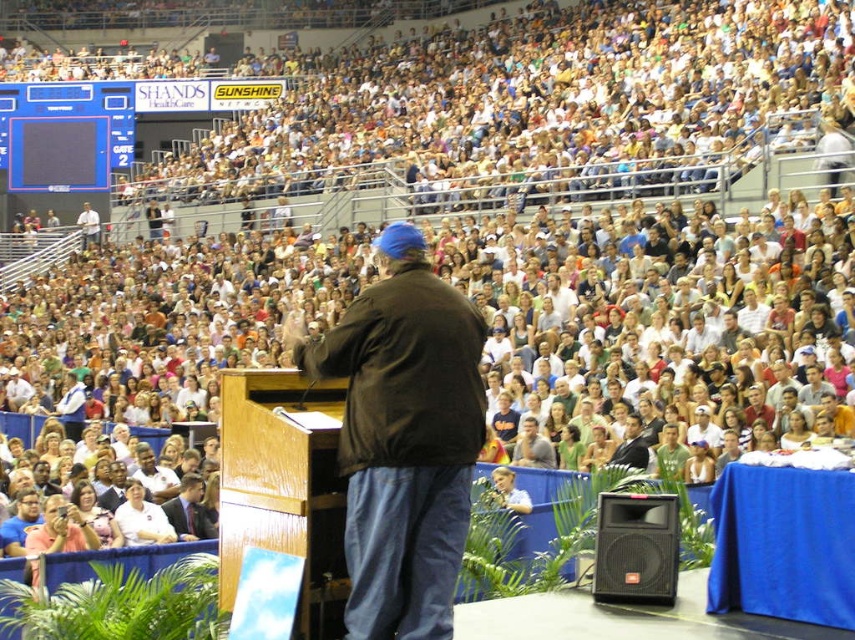
You are an event organizer trying to ensure all attendees have enough space. You notice the dark brown leather jacket at center and the white shirt at lower left. Which clothing item takes up more horizontal space?

The dark brown leather jacket at center takes up more horizontal space because its width is larger than the white shirt at lower left.

You are standing at the wooden podium where the man is speaking. You want to walk directly to the point marked at coordinates point (408, 280). Will you pass by the point marked at coordinates point (131, 525) on your way there?

No, because point (408, 280) is in front of point (131, 525), so you would reach the first point without passing the second one.

You are standing in the arena and want to move to the point marked at coordinates (x=658, y=534). The arena has a clear path, but there are stairs leading up to the seating area every 20 feet. How many sets of stairs will you need to climb to reach that point?

The point marked at coordinates (x=658, y=534) is 65.86 feet away from you. Since stairs are placed every 20 feet, you will need to climb 4 sets of stairs to cover the distance.